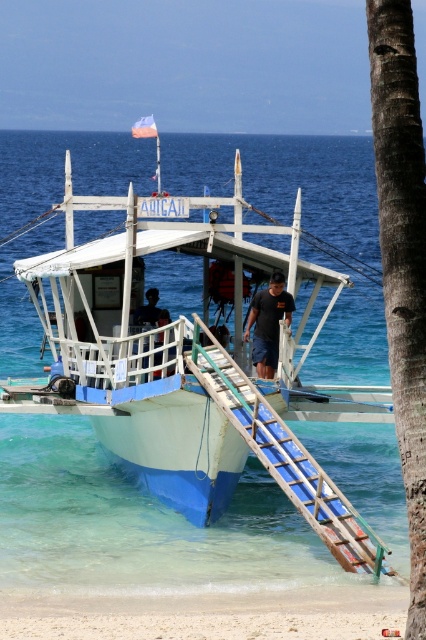
Does smooth brown trunk of palm tree at center right appear under dark blue shorts at center?

No, smooth brown trunk of palm tree at center right is not below dark blue shorts at center.

Is smooth brown trunk of palm tree at center right further to the viewer compared to dark blue shorts at center?

No, smooth brown trunk of palm tree at center right is in front of dark blue shorts at center.

Where is `smooth brown trunk of palm tree at center right`? This screenshot has width=426, height=640. smooth brown trunk of palm tree at center right is located at coordinates (402, 259).

Is white wooden boat at center to the right of white sand beach at lower left from the viewer's perspective?

No, white wooden boat at center is not to the right of white sand beach at lower left.

The width and height of the screenshot is (426, 640). I want to click on white wooden boat at center, so click(x=137, y=516).

Does blue plastic ladder at lower center come behind dark blue shorts at center?

No, it is not.

Does point (273, 422) come closer to viewer compared to point (270, 355)?

Yes, it is.

Where is `blue plastic ladder at lower center`? Image resolution: width=426 pixels, height=640 pixels. blue plastic ladder at lower center is located at coordinates (288, 461).